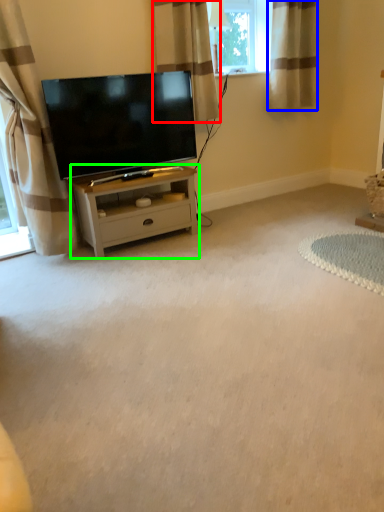
Question: Considering the real-world distances, which object is closest to curtain (highlighted by a red box)? curtain (highlighted by a blue box) or nightstand (highlighted by a green box).

Choices:
 (A) curtain
 (B) nightstand

Answer: (A)